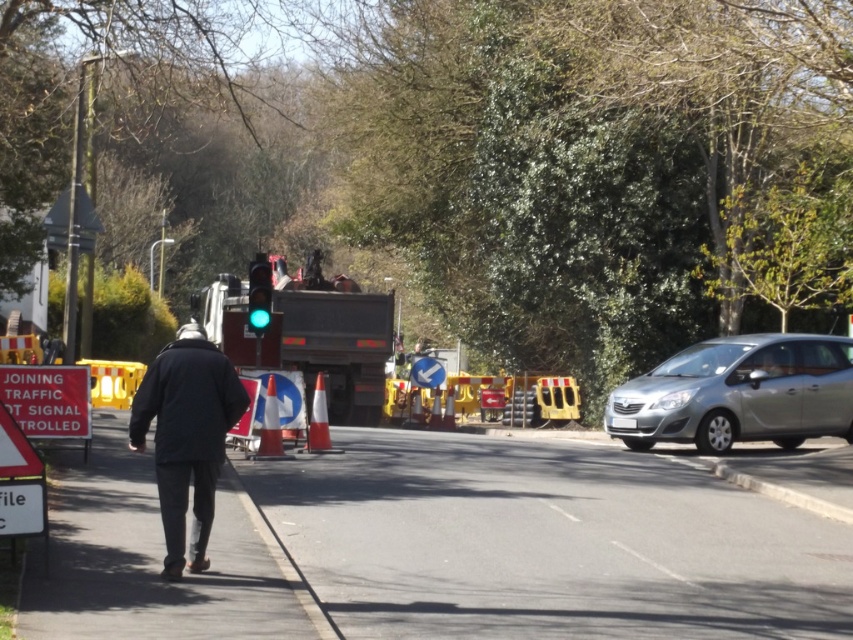
Looking at this image, does dark blue jacket at center come behind green glass traffic light at center?

No, it is not.

Is point (161, 467) positioned in front of point (248, 316)?

Yes, it is in front of point (248, 316).

Where is `dark blue jacket at center`? The width and height of the screenshot is (853, 640). dark blue jacket at center is located at coordinates (186, 435).

Does dark blue jacket at center have a lesser height compared to white plastic arrow at center?

No.

Does dark blue jacket at center have a smaller size compared to white plastic arrow at center?

No, dark blue jacket at center is not smaller than white plastic arrow at center.

Is point (167, 493) behind point (416, 371)?

No.

I want to click on dark blue jacket at center, so click(186, 435).

Is silver metallic car at right positioned behind dark blue jacket at center?

Yes, silver metallic car at right is further from the viewer.

From the picture: Which is more to the left, silver metallic car at right or dark blue jacket at center?

dark blue jacket at center

What do you see at coordinates (738, 394) in the screenshot?
I see `silver metallic car at right` at bounding box center [738, 394].

Locate an element on the screen. The width and height of the screenshot is (853, 640). silver metallic car at right is located at coordinates (738, 394).